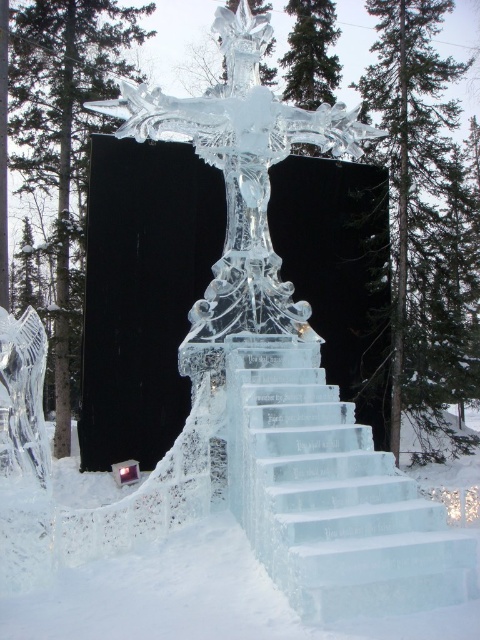
Is clear ice stairs at center positioned at the back of clear ice sculpture at center?

No, it is in front of clear ice sculpture at center.

Consider the image. Can you confirm if clear ice stairs at center is taller than clear ice sculpture at center?

Yes, clear ice stairs at center is taller than clear ice sculpture at center.

Is point (464, 545) farther from viewer compared to point (205, 144)?

That is False.

This screenshot has width=480, height=640. I want to click on clear ice stairs at center, so click(x=330, y=493).